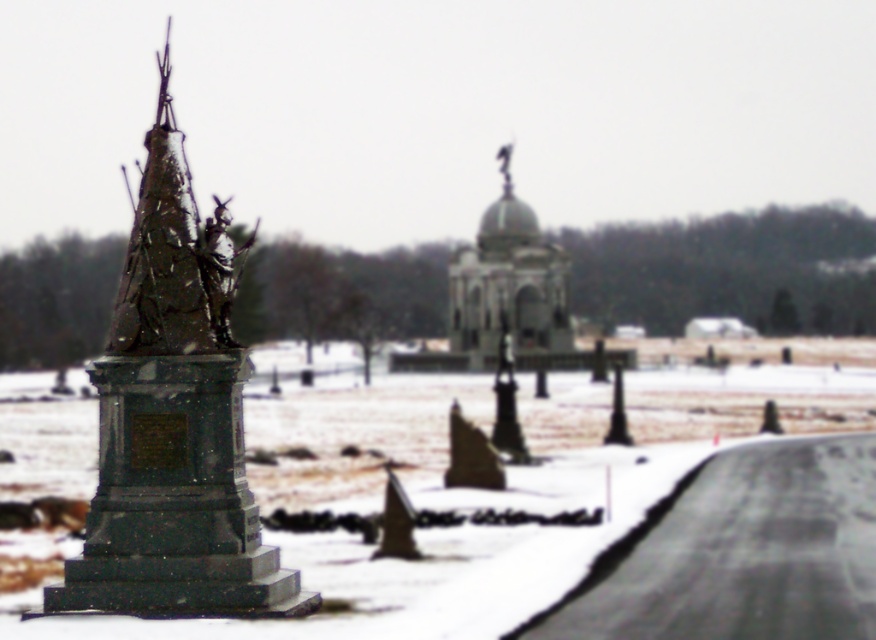
Question: Does bronze statue at left appear over smooth gray dome at center?

Choices:
 (A) no
 (B) yes

Answer: (B)

Question: Does bronze statue at left have a greater width compared to smooth gray dome at center?

Choices:
 (A) no
 (B) yes

Answer: (B)

Question: Which point is closer to the camera taking this photo?

Choices:
 (A) (533, 252)
 (B) (161, 406)

Answer: (B)

Question: In this image, where is bronze statue at left located relative to smooth gray dome at center?

Choices:
 (A) right
 (B) left

Answer: (B)

Question: Which point is farther to the camera?

Choices:
 (A) bronze statue at left
 (B) smooth gray dome at center

Answer: (B)